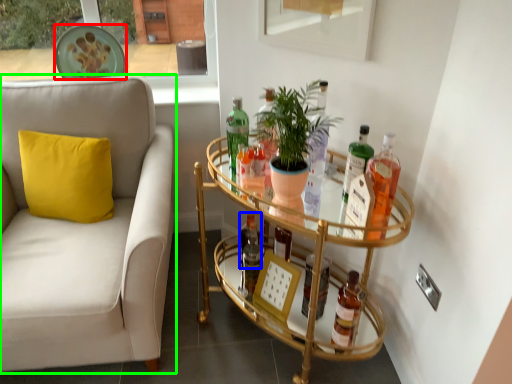
Question: Based on their relative distances, which object is nearer to plate (highlighted by a red box)? Choose from bottle (highlighted by a blue box) and studio couch (highlighted by a green box).

Choices:
 (A) bottle
 (B) studio couch

Answer: (B)